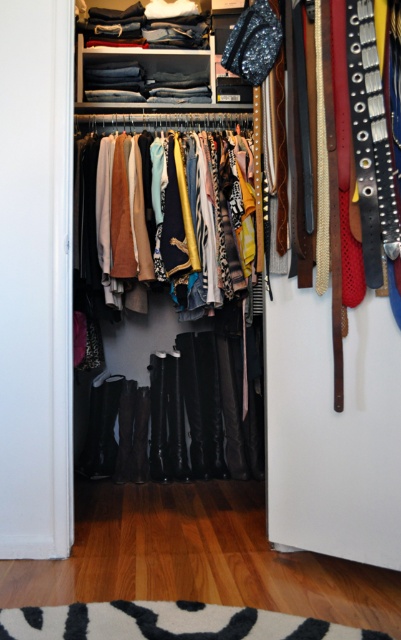
Question: Is matte black pants at center thinner than white soft rug at lower center?

Choices:
 (A) no
 (B) yes

Answer: (B)

Question: Among these objects, which one is nearest to the camera?

Choices:
 (A) matte black pants at center
 (B) textured wool sweater at center
 (C) white soft rug at lower center

Answer: (C)

Question: Can you confirm if matte black pants at center is positioned above white soft rug at lower center?

Choices:
 (A) no
 (B) yes

Answer: (B)

Question: Is white soft rug at lower center closer to the viewer compared to textured wool sweater at center?

Choices:
 (A) yes
 (B) no

Answer: (A)

Question: Based on their relative distances, which object is nearer to the textured wool sweater at center?

Choices:
 (A) white soft rug at lower center
 (B) matte black pants at center

Answer: (B)

Question: Among these points, which one is nearest to the camera?

Choices:
 (A) (0, 614)
 (B) (338, 483)
 (C) (115, 166)

Answer: (A)